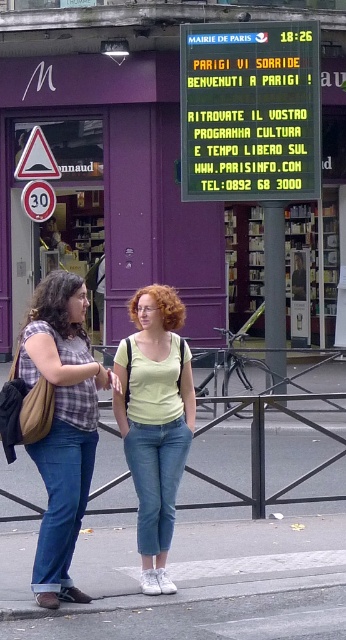
Question: Does matte plaid shirt at center appear on the left side of red plastic speed limit sign at left?

Choices:
 (A) yes
 (B) no

Answer: (B)

Question: Is blue digital display at upper center wider than light green cotton tank top at center?

Choices:
 (A) yes
 (B) no

Answer: (A)

Question: Which is farther from the blue digital display at upper center?

Choices:
 (A) light green cotton tank top at center
 (B) red plastic speed limit sign at left

Answer: (A)

Question: Which of these objects is positioned closest to the matte plaid shirt at center?

Choices:
 (A) light green cotton tank top at center
 (B) blue digital display at upper center

Answer: (A)

Question: Is matte plaid shirt at center closer to camera compared to red plastic speed limit sign at left?

Choices:
 (A) no
 (B) yes

Answer: (B)

Question: Which of the following is the closest to the observer?

Choices:
 (A) (277, 35)
 (B) (50, 212)
 (C) (76, 337)

Answer: (C)